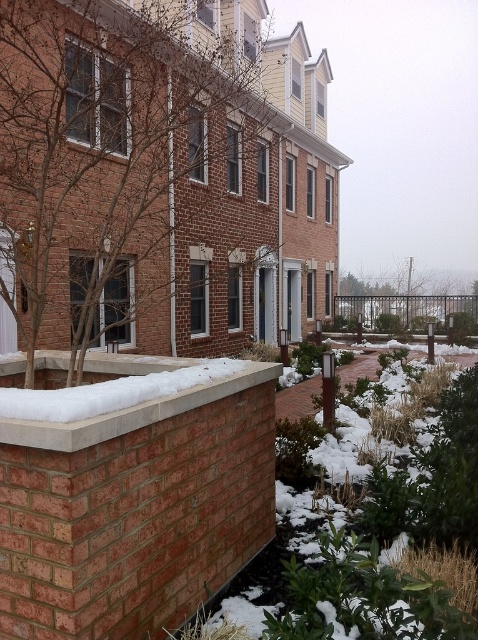
Question: Is concrete at center wider than green leafy tree at center?

Choices:
 (A) yes
 (B) no

Answer: (B)

Question: Which of the following is the farthest from the observer?

Choices:
 (A) green leafy tree at center
 (B) brown leafless tree at upper left
 (C) concrete at center

Answer: (A)

Question: Which of the following is the farthest from the observer?

Choices:
 (A) brown leafless tree at upper left
 (B) green leafy tree at center

Answer: (B)

Question: Is concrete at center below green leafy tree at center?

Choices:
 (A) no
 (B) yes

Answer: (B)

Question: Does brown leafless tree at upper left appear over green leafy tree at center?

Choices:
 (A) no
 (B) yes

Answer: (B)

Question: Which point appears closest to the camera in this image?

Choices:
 (A) (434, 317)
 (B) (155, 417)

Answer: (B)